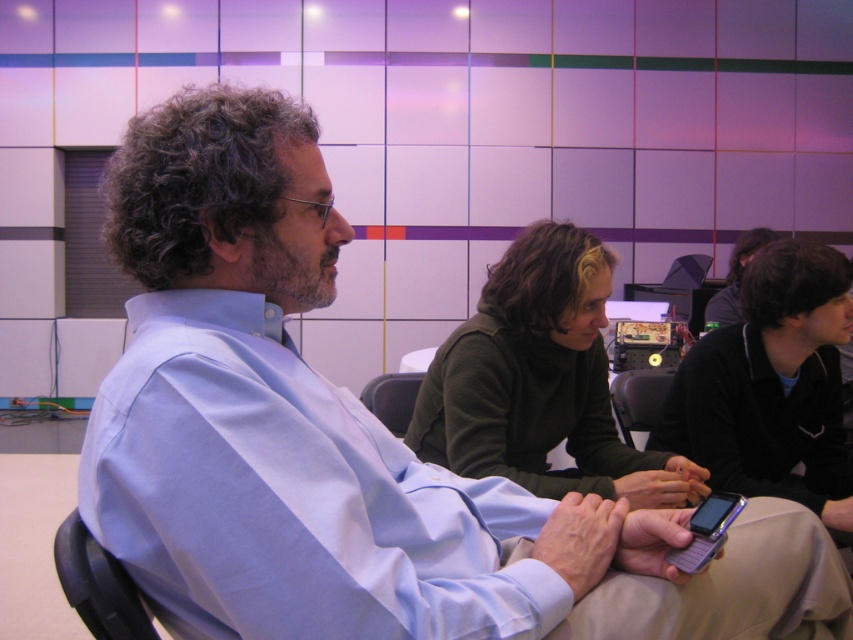
Question: Can you confirm if black plastic chair at center is thinner than gray plastic chair at center?

Choices:
 (A) no
 (B) yes

Answer: (A)

Question: Which object appears closest to the camera in this image?

Choices:
 (A) black plastic chair at center
 (B) black matte phone at center
 (C) gray plastic chair at center

Answer: (B)

Question: Estimate the real-world distances between objects in this image. Which object is farther from the black matte phone at center?

Choices:
 (A) black plastic chair at center
 (B) gray plastic chair at center

Answer: (B)

Question: Which of the following is the closest to the observer?

Choices:
 (A) (641, 376)
 (B) (401, 372)

Answer: (A)

Question: Does black matte phone at center have a larger size compared to gray plastic chair at center?

Choices:
 (A) yes
 (B) no

Answer: (A)

Question: Is black matte phone at center positioned at the back of gray plastic chair at center?

Choices:
 (A) no
 (B) yes

Answer: (A)